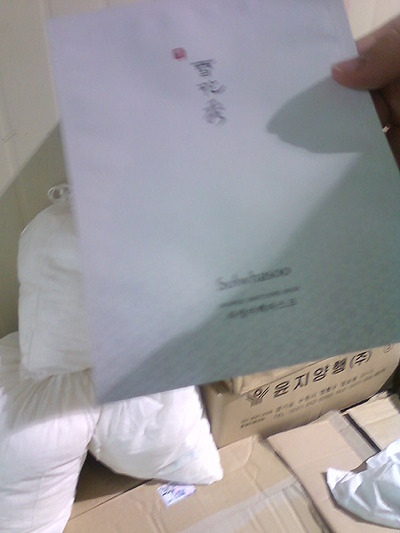
The image size is (400, 533). I want to click on cardboard box, so click(x=131, y=519), click(x=302, y=442), click(x=230, y=419), click(x=252, y=376).